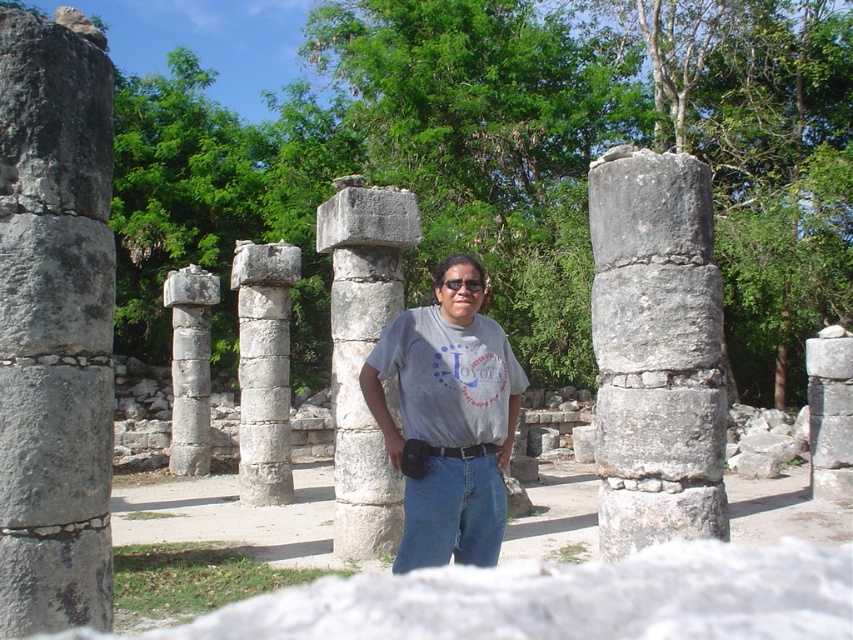
Who is taller, gray stone column at left or smooth stone column at right?

gray stone column at left is taller.

The height and width of the screenshot is (640, 853). Find the location of `gray stone column at left`. gray stone column at left is located at coordinates (54, 323).

Does point (3, 362) come behind point (833, 428)?

No, (3, 362) is closer to viewer.

The height and width of the screenshot is (640, 853). Find the location of `gray stone column at left`. gray stone column at left is located at coordinates (54, 323).

Does gray stone column at left have a lesser width compared to smooth stone column at center?

Yes.

Does gray stone column at left have a greater height compared to smooth stone column at center?

In fact, gray stone column at left may be shorter than smooth stone column at center.

Who is more distant from viewer, (93, 515) or (196, 442)?

The point (196, 442) is behind.

Find the location of a particular element. gray stone column at left is located at coordinates (54, 323).

Does point (641, 410) come behind point (276, 428)?

No.

Is gray stone column at right above gray stone column at center?

Yes, gray stone column at right is above gray stone column at center.

Is point (664, 234) closer to camera compared to point (276, 284)?

Yes, it is in front of point (276, 284).

Image resolution: width=853 pixels, height=640 pixels. What are the coordinates of `gray stone column at right` in the screenshot? It's located at (656, 352).